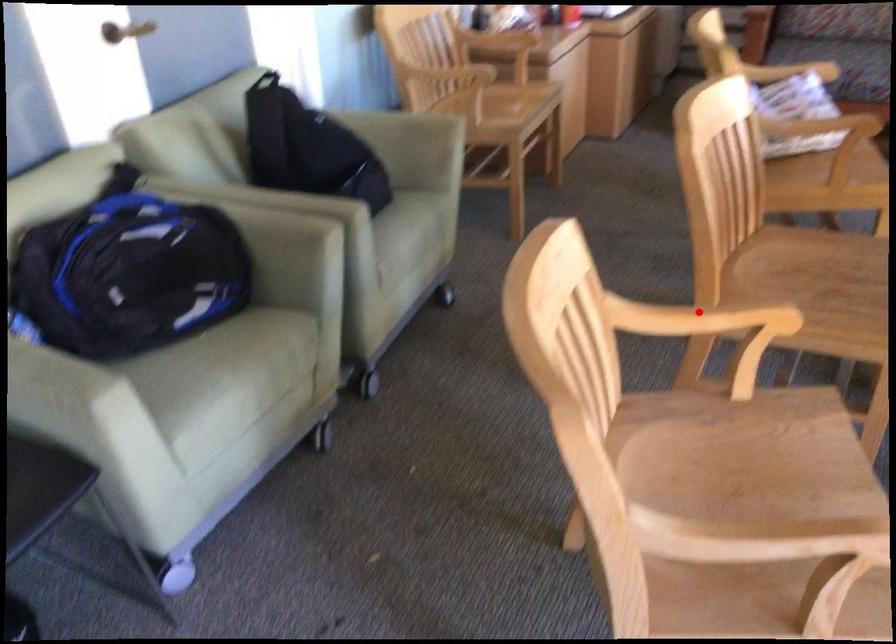
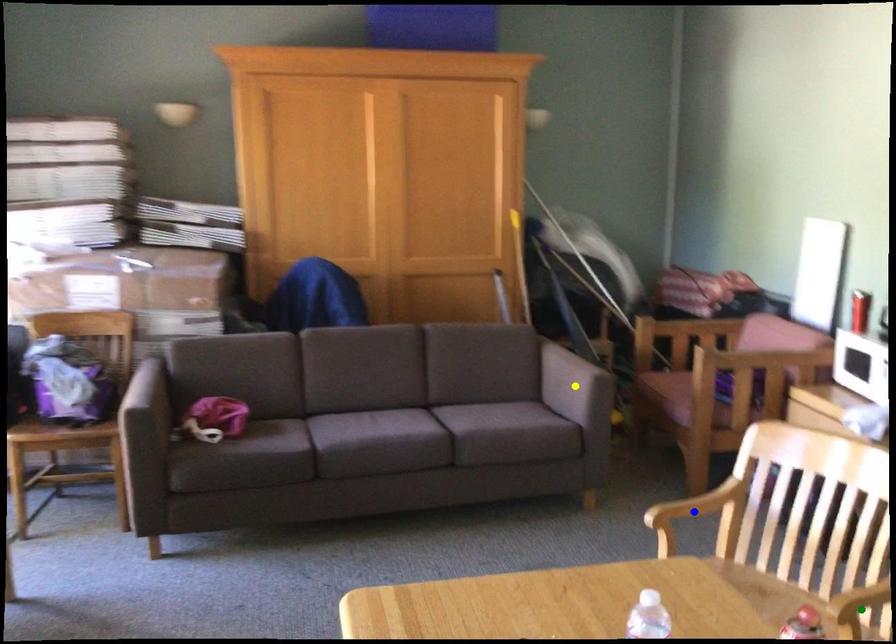
Question: I am providing you with two images of the same scene from different viewpoints. A red point is marked on the first image. You are given multiple points on the second image. Which point in image 2 represents the same 3d spot as the red point in image 1?

Choices:
 (A) yellow point
 (B) green point
 (C) blue point

Answer: (B)